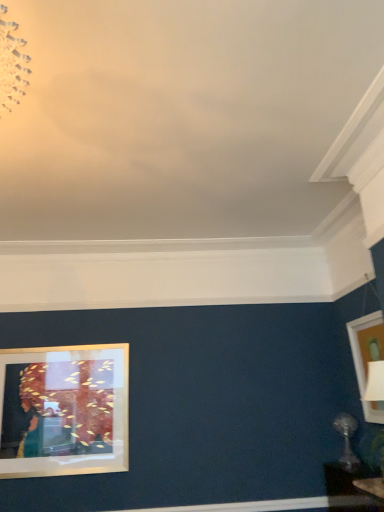
Question: Is satin silver table lamp at lower right surrounding matte gold picture frame at upper right?

Choices:
 (A) yes
 (B) no

Answer: (B)

Question: Considering the relative sizes of satin silver table lamp at lower right and matte gold picture frame at upper right in the image provided, is satin silver table lamp at lower right thinner than matte gold picture frame at upper right?

Choices:
 (A) yes
 (B) no

Answer: (B)

Question: Is satin silver table lamp at lower right positioned behind matte gold picture frame at upper right?

Choices:
 (A) yes
 (B) no

Answer: (A)

Question: From a real-world perspective, is satin silver table lamp at lower right beneath matte gold picture frame at upper right?

Choices:
 (A) no
 (B) yes

Answer: (B)

Question: Is satin silver table lamp at lower right taller than matte gold picture frame at upper right?

Choices:
 (A) no
 (B) yes

Answer: (A)

Question: Looking at their shapes, would you say matte gold picture frame at upper right is wider or thinner than matte black table at lower right?

Choices:
 (A) wide
 (B) thin

Answer: (B)

Question: From a real-world perspective, is matte gold picture frame at upper right above or below matte black table at lower right?

Choices:
 (A) below
 (B) above

Answer: (B)

Question: Considering the positions of point (367, 336) and point (337, 506), is point (367, 336) closer or farther from the camera than point (337, 506)?

Choices:
 (A) farther
 (B) closer

Answer: (A)

Question: In the image, is matte gold picture frame at upper right on the left side or the right side of matte black table at lower right?

Choices:
 (A) left
 (B) right

Answer: (B)

Question: From a real-world perspective, relative to matte gold picture frame at upper right, is satin silver table lamp at lower right vertically above or below?

Choices:
 (A) below
 (B) above

Answer: (A)

Question: Do you think satin silver table lamp at lower right is within matte gold picture frame at upper right, or outside of it?

Choices:
 (A) inside
 (B) outside

Answer: (B)

Question: In terms of width, does satin silver table lamp at lower right look wider or thinner when compared to matte gold picture frame at upper right?

Choices:
 (A) wide
 (B) thin

Answer: (A)

Question: Relative to matte gold picture frame at upper right, is satin silver table lamp at lower right in front or behind?

Choices:
 (A) front
 (B) behind

Answer: (B)

Question: Is point click(x=331, y=484) positioned closer to the camera than point click(x=352, y=353)?

Choices:
 (A) farther
 (B) closer

Answer: (B)

Question: From the image's perspective, is matte black table at lower right above or below matte gold picture frame at upper right?

Choices:
 (A) below
 (B) above

Answer: (A)